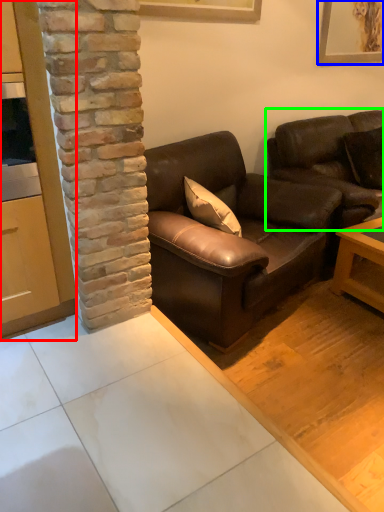
Question: Considering the real-world distances, which object is farthest from cabinetry (highlighted by a red box)? picture frame (highlighted by a blue box) or studio couch (highlighted by a green box)?

Choices:
 (A) picture frame
 (B) studio couch

Answer: (A)